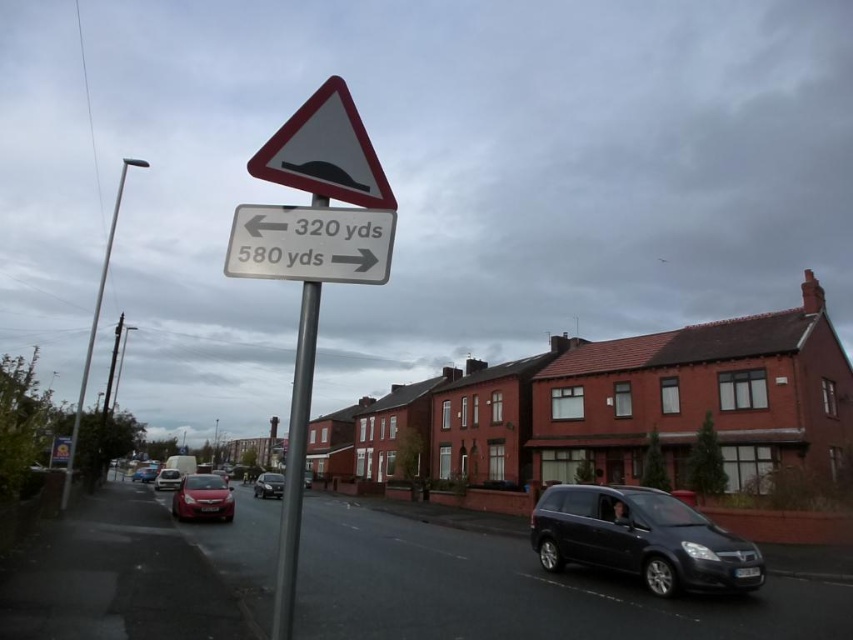
Question: Considering the relative positions of white plastic triangle at upper center and matte red car at center in the image provided, where is white plastic triangle at upper center located with respect to matte red car at center?

Choices:
 (A) above
 (B) below

Answer: (A)

Question: Is white plastic triangle at upper center positioned behind matte red car at center?

Choices:
 (A) yes
 (B) no

Answer: (B)

Question: Which of the following is the farthest from the observer?

Choices:
 (A) shiny red car at center
 (B) silver metallic pole at left
 (C) shiny black car at center

Answer: (C)

Question: Is metallic pole at center bigger than shiny red car at center?

Choices:
 (A) no
 (B) yes

Answer: (B)

Question: Considering the real-world distances, which object is closest to the shiny black car at center?

Choices:
 (A) shiny red car at center
 (B) matte red car at center

Answer: (B)

Question: Which of the following is the closest to the observer?

Choices:
 (A) (289, 156)
 (B) (86, 356)

Answer: (A)